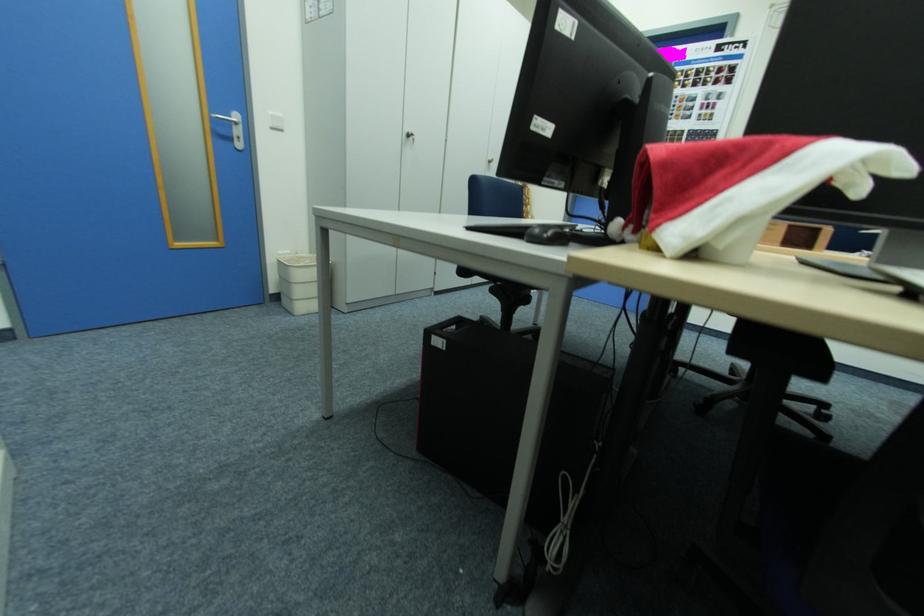
Locate an element on the screen. Image resolution: width=924 pixels, height=616 pixels. silver door handle is located at coordinates (227, 119).